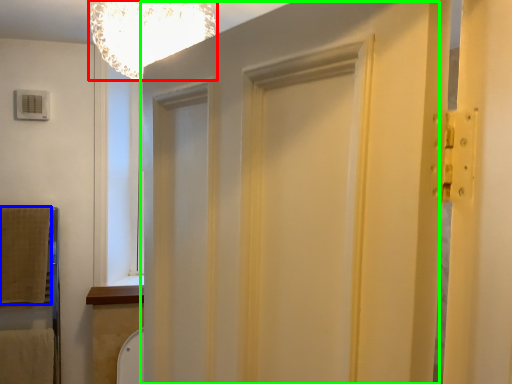
Question: Which object is the closest to the light fixture (highlighted by a red box)? Choose among these: blanket (highlighted by a blue box) or barn door (highlighted by a green box).

Choices:
 (A) blanket
 (B) barn door

Answer: (B)